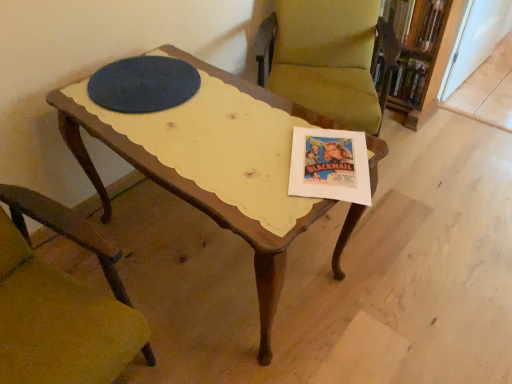
Locate an element on the screen. Image resolution: width=512 pixels, height=384 pixels. wooden chair at lower left, the first chair ordered from the bottom is located at coordinates (60, 304).

Can we say wooden bookcase at upper right lies outside wooden chair at lower left, the first chair in the front-to-back sequence?

wooden bookcase at upper right is positioned outside wooden chair at lower left, the first chair in the front-to-back sequence.

Can you confirm if wooden bookcase at upper right is thinner than wooden chair at lower left, the 2th chair viewed from the top?

Yes, wooden bookcase at upper right is thinner than wooden chair at lower left, the 2th chair viewed from the top.

Which object is further away from the camera taking this photo, wooden bookcase at upper right or wooden chair at lower left, marked as the 2th chair in a right-to-left arrangement?

wooden bookcase at upper right is further from the camera.

Is wooden bookcase at upper right positioned with its back to wooden chair at lower left, arranged as the 1th chair when viewed from the left?

No.

From the image's perspective, which object appears higher, wooden bookcase at upper right or velvet green chair at center, positioned as the 1th chair in top-to-bottom order?

wooden bookcase at upper right is shown above in the image.

Which is correct: wooden bookcase at upper right is inside velvet green chair at center, the 1th chair in the back-to-front sequence, or outside of it?

wooden bookcase at upper right is not inside velvet green chair at center, the 1th chair in the back-to-front sequence, it's outside.

Is wooden bookcase at upper right shorter than velvet green chair at center, which is the 2th chair from left to right?

Yes, wooden bookcase at upper right is shorter than velvet green chair at center, which is the 2th chair from left to right.

Are wooden bookcase at upper right and velvet green chair at center, the 2th chair viewed from the front, far apart?

That's not correct — wooden bookcase at upper right is a little close to velvet green chair at center, the 2th chair viewed from the front.

From a real-world perspective, is hardcover book at upper right on velvet green chair at center, the 2th chair viewed from the front?

Indeed, from a real-world perspective, hardcover book at upper right stands above velvet green chair at center, the 2th chair viewed from the front.

Is hardcover book at upper right in front of velvet green chair at center, positioned as the 1th chair in top-to-bottom order?

No.

Is hardcover book at upper right next to velvet green chair at center, the 2th chair viewed from the front, and touching it?

hardcover book at upper right and velvet green chair at center, the 2th chair viewed from the front, are clearly separated.

Relative to velvet green chair at center, positioned as the 1th chair in top-to-bottom order, is wooden chair at lower left, the first chair ordered from the bottom, in front or behind?

In the image, wooden chair at lower left, the first chair ordered from the bottom, appears in front of velvet green chair at center, positioned as the 1th chair in top-to-bottom order.

Considering the sizes of objects wooden chair at lower left, the 2th chair viewed from the back, and velvet green chair at center, the 2th chair viewed from the front, in the image provided, who is wider, wooden chair at lower left, the 2th chair viewed from the back, or velvet green chair at center, the 2th chair viewed from the front,?

With larger width is velvet green chair at center, the 2th chair viewed from the front.

From the image's perspective, is wooden chair at lower left, the 2th chair viewed from the back, beneath velvet green chair at center, the 1th chair in the back-to-front sequence?

Yes.

Find the location of a particular element. Image resolution: width=512 pixels, height=384 pixels. chair above the wooden chair at lower left, marked as the 2th chair in a right-to-left arrangement (from the image's perspective) is located at coordinates [x=329, y=58].

From the image's perspective, who appears lower, hardcover book at upper right or wooden bookcase at upper right?

From the image's view, wooden bookcase at upper right is below.

Would you consider hardcover book at upper right to be distant from wooden bookcase at upper right?

No, hardcover book at upper right is not far away from wooden bookcase at upper right.

Can you tell me how much hardcover book at upper right and wooden bookcase at upper right differ in facing direction?

hardcover book at upper right and wooden bookcase at upper right are facing 2.37 degrees away from each other.

In terms of size, does hardcover book at upper right appear bigger or smaller than wooden chair at lower left, arranged as the 1th chair when viewed from the left?

Clearly, hardcover book at upper right is smaller in size than wooden chair at lower left, arranged as the 1th chair when viewed from the left.

Looking at this image, is hardcover book at upper right facing towards wooden chair at lower left, marked as the 2th chair in a right-to-left arrangement?

Yes.

This screenshot has width=512, height=384. In order to click on book above the wooden chair at lower left, the 2th chair viewed from the back (from the image's perspective) in this screenshot , I will do `click(416, 21)`.

From the image's perspective, is hardcover book at upper right beneath wooden chair at lower left, the first chair ordered from the bottom?

No.

Which object is closer to the camera taking this photo, wooden chair at lower left, the 2th chair viewed from the back, or wooden bookcase at upper right?

wooden chair at lower left, the 2th chair viewed from the back.

In terms of width, does wooden chair at lower left, the first chair ordered from the bottom, look wider or thinner when compared to wooden bookcase at upper right?

Considering their sizes, wooden chair at lower left, the first chair ordered from the bottom, looks broader than wooden bookcase at upper right.

Can you confirm if wooden chair at lower left, the 2th chair viewed from the back, is positioned to the right of wooden bookcase at upper right?

In fact, wooden chair at lower left, the 2th chair viewed from the back, is to the left of wooden bookcase at upper right.

Is wooden chair at lower left, the first chair ordered from the bottom, facing away from wooden bookcase at upper right?

wooden chair at lower left, the first chair ordered from the bottom, does not have its back to wooden bookcase at upper right.

Find the location of `chair that is the 2nd object above the wooden bookcase at upper right (from a real-world perspective)`. chair that is the 2nd object above the wooden bookcase at upper right (from a real-world perspective) is located at coordinates (60, 304).

The height and width of the screenshot is (384, 512). I want to click on bookcase on the right side of velvet green chair at center, the 1th chair in the back-to-front sequence, so click(421, 54).

Estimate the real-world distances between objects in this image. Which object is further from velvet green chair at center, which is the 2th chair from bottom to top, wooden chair at lower left, the 2th chair viewed from the back, or wooden bookcase at upper right?

wooden chair at lower left, the 2th chair viewed from the back, is further to velvet green chair at center, which is the 2th chair from bottom to top.

Which object lies nearer to the anchor point wooden bookcase at upper right, velvet green chair at center, positioned as the 1th chair in top-to-bottom order, or wooden chair at lower left, the 2th chair viewed from the back?

velvet green chair at center, positioned as the 1th chair in top-to-bottom order, lies closer to wooden bookcase at upper right than the other object.

Considering their positions, is wooden chair at lower left, the first chair in the front-to-back sequence, positioned further to hardcover book at upper right than velvet green chair at center, which is the 2th chair from bottom to top?

wooden chair at lower left, the first chair in the front-to-back sequence, is further to hardcover book at upper right.

Which object lies further to the anchor point wooden bookcase at upper right, wooden chair at lower left, marked as the 2th chair in a right-to-left arrangement, or hardcover book at upper right?

The object further to wooden bookcase at upper right is wooden chair at lower left, marked as the 2th chair in a right-to-left arrangement.

Estimate the real-world distances between objects in this image. Which object is further from hardcover book at upper right, wooden bookcase at upper right or wooden chair at lower left, arranged as the 1th chair when viewed from the left?

wooden chair at lower left, arranged as the 1th chair when viewed from the left, lies further to hardcover book at upper right than the other object.

Looking at the image, which one is located closer to wooden chair at lower left, the 2th chair viewed from the top, velvet green chair at center, positioned as the 1th chair in top-to-bottom order, or wooden bookcase at upper right?

velvet green chair at center, positioned as the 1th chair in top-to-bottom order, lies closer to wooden chair at lower left, the 2th chair viewed from the top, than the other object.

Estimate the real-world distances between objects in this image. Which object is closer to wooden chair at lower left, the first chair ordered from the bottom, velvet green chair at center, the 2th chair viewed from the front, or hardcover book at upper right?

velvet green chair at center, the 2th chair viewed from the front, lies closer to wooden chair at lower left, the first chair ordered from the bottom, than the other object.

When comparing their distances from hardcover book at upper right, does velvet green chair at center, which is the 2th chair from left to right, or wooden chair at lower left, the 2th chair viewed from the top, seem closer?

The object closer to hardcover book at upper right is velvet green chair at center, which is the 2th chair from left to right.

Identify the location of chair between wooden chair at lower left, the 2th chair viewed from the top, and hardcover book at upper right in the front-back direction. The image size is (512, 384). (329, 58).

Where is `book located between velvet green chair at center, positioned as the 1th chair in top-to-bottom order, and wooden bookcase at upper right in the left-right direction`? Image resolution: width=512 pixels, height=384 pixels. book located between velvet green chair at center, positioned as the 1th chair in top-to-bottom order, and wooden bookcase at upper right in the left-right direction is located at coordinates (416, 21).

What are the coordinates of `chair located between wooden chair at lower left, the first chair ordered from the bottom, and wooden bookcase at upper right in the left-right direction` in the screenshot? It's located at (329, 58).

This screenshot has width=512, height=384. I want to click on book situated between wooden chair at lower left, the 2th chair viewed from the top, and wooden bookcase at upper right from left to right, so click(x=416, y=21).